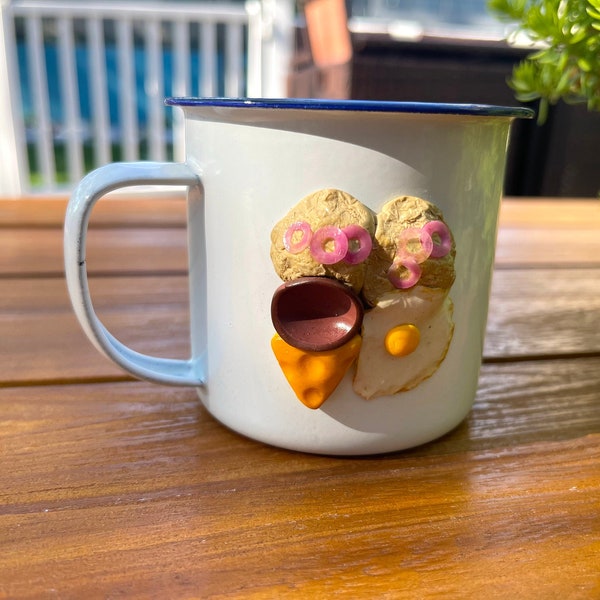
This screenshot has width=600, height=600. Find the location of `cup handle`. cup handle is located at coordinates (75, 212).